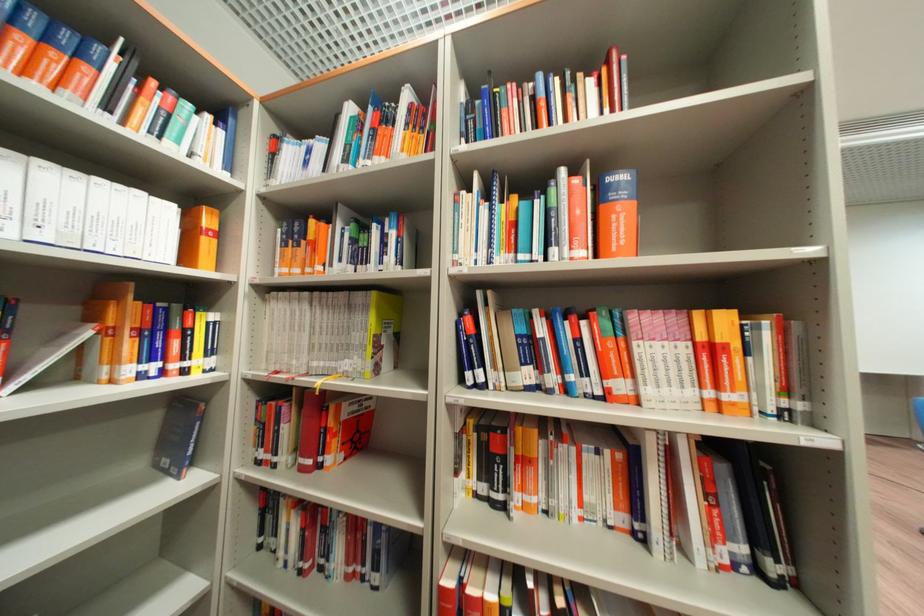
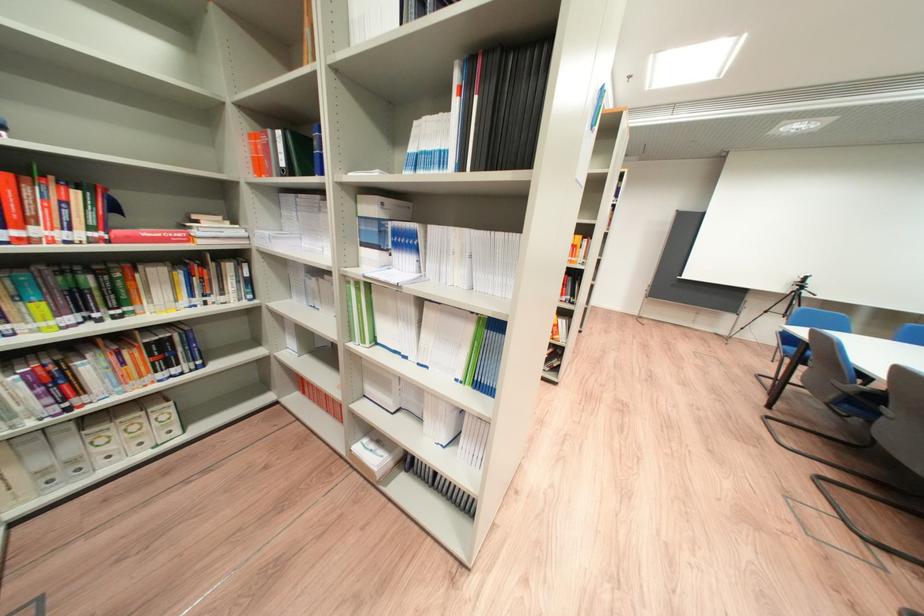
Question: I am providing you with two images of the same scene from different viewpoints. Please identify which objects are invisible in image2.

Choices:
 (A) red book
 (B) book on shelf
 (C) wall button panel
 (D) small white box

Answer: (A)